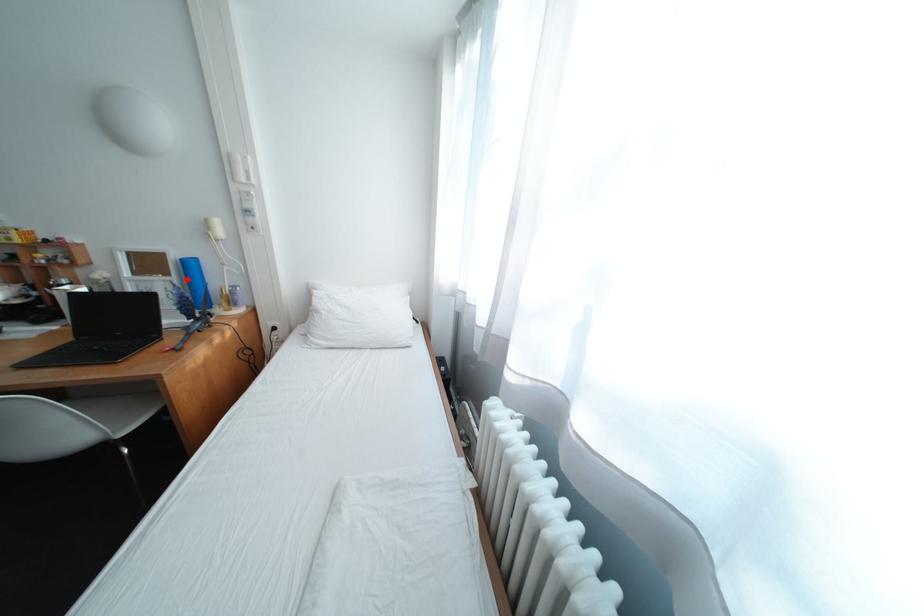
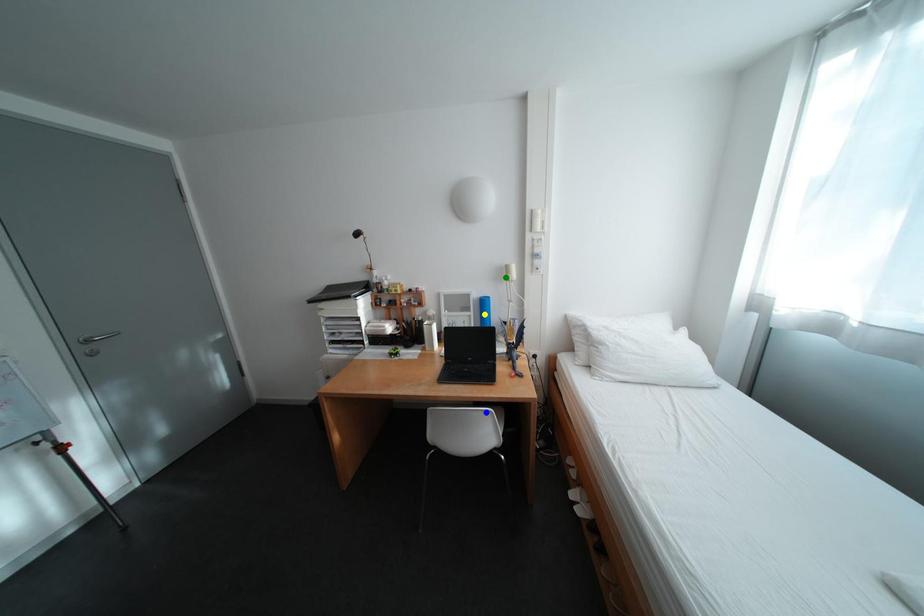
Question: I am providing you with two images of the same scene from different viewpoints. A red point is marked on the first image. You are given multiple points on the second image. Which spot in image 2 lines up with the point in image 1?

Choices:
 (A) green point
 (B) blue point
 (C) yellow point

Answer: (C)